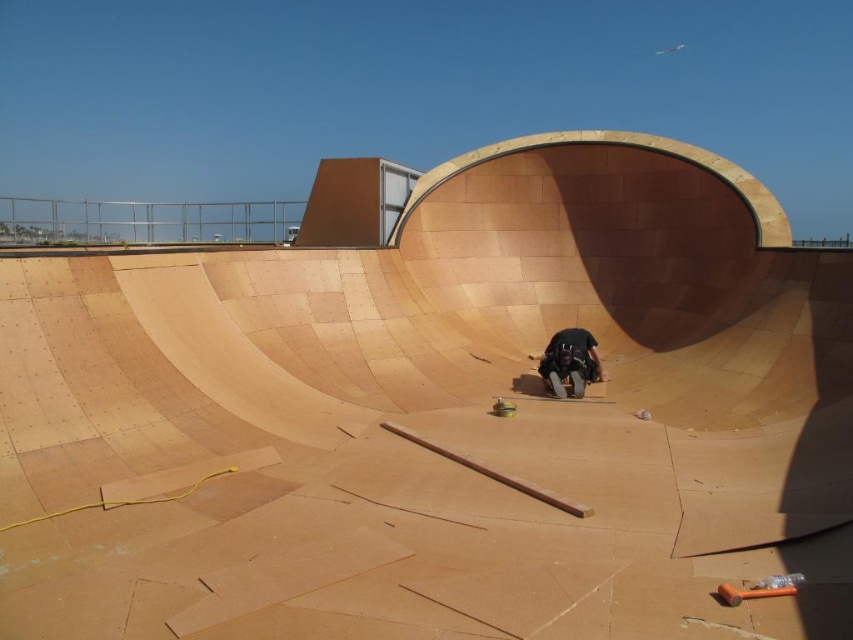
You are a safety inspector visiting the skatepark construction site. You notice the black matte skateboarder at center and the smooth brown skateboard at center. Which object is closer to the ground?

The smooth brown skateboard at center is closer to the ground because the black matte skateboarder at center is taller than it.

Looking at this image, you are a construction worker at the skatepark and need to place a tool between the black matte skateboarder at center and the smooth brown skateboard at center. Based on their positions, which side of the skateboard should you place the tool on?

The black matte skateboarder at center is to the right of the smooth brown skateboard at center, so the tool should be placed to the left of the smooth brown skateboard at center to keep it near both objects.

You are a construction inspector checking the skatepark bowl. You see the black matte skateboarder at center and the smooth brown skateboard at center. Which object is wider?

The black matte skateboarder at center is wider than the smooth brown skateboard at center.